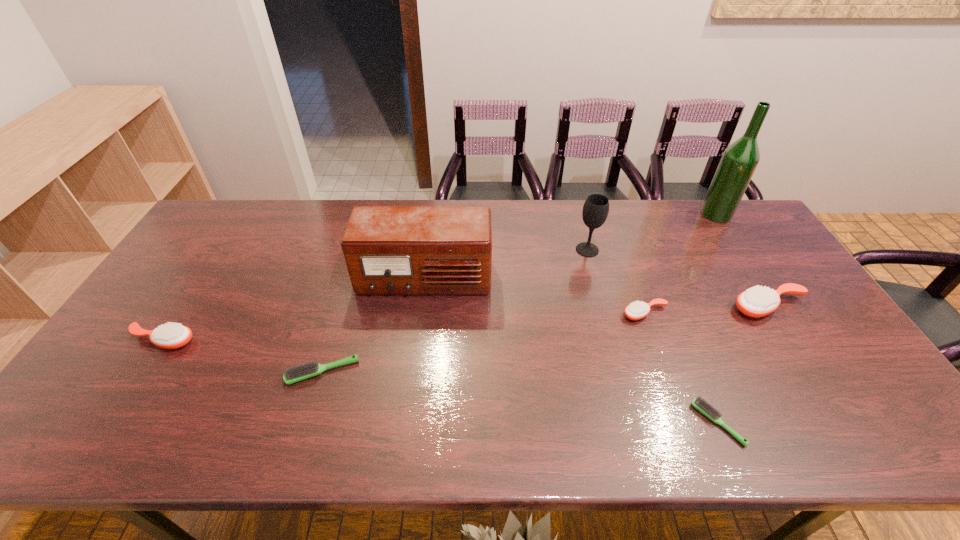
Locate an element on the screen. This screenshot has height=540, width=960. the bigger light hairbrush is located at coordinates (294, 374).

Find the location of a particular element. This screenshot has width=960, height=540. the second nearest hairbrush is located at coordinates (294, 374).

This screenshot has width=960, height=540. Find the location of `the shortest object`. the shortest object is located at coordinates (704, 407).

Where is `the nearest hairbrush`? the nearest hairbrush is located at coordinates (704, 407).

I want to click on free location located 0.350m on the front of the tallest object, so click(x=769, y=295).

Locate an element on the screen. Image resolution: width=960 pixels, height=540 pixels. vacant space situated 0.140m on the front-facing side of the radio receiver is located at coordinates (417, 339).

The width and height of the screenshot is (960, 540). Find the location of `vacant region located on the front of the wineglass`. vacant region located on the front of the wineglass is located at coordinates (607, 322).

This screenshot has height=540, width=960. In order to click on vacant space situated 0.260m on the back of the biggest orange hairbrush in this screenshot , I will do `click(725, 237)`.

Where is `vacant region located on the back of the fourth shortest hairbrush`? The image size is (960, 540). vacant region located on the back of the fourth shortest hairbrush is located at coordinates (184, 307).

I want to click on vacant space located 0.220m on the left of the second orange hairbrush from right to left, so click(544, 314).